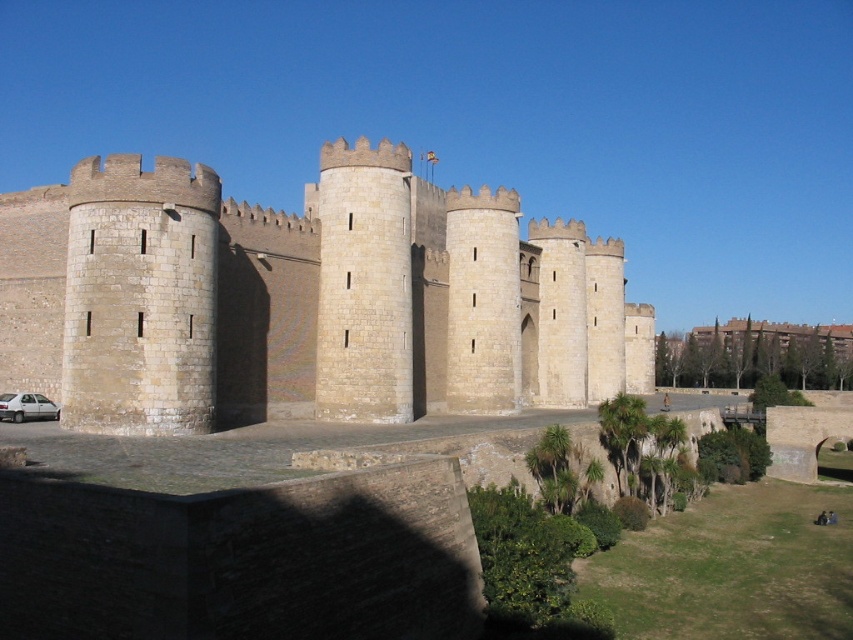
From the picture: You are standing at the entrance of the historic castle and notice two points marked on the ground. One is labeled as point (621, 358) and the other as point (35, 396). If you want to walk towards the castle walls, which point should you avoid stepping on to stay closer to the castle structure?

You should avoid stepping on point (35, 396) because point (621, 358) is closer to the castle walls as it is further to the viewer compared to point (35, 396).

Based on the photo, you are a photographer planning to capture a wide shot of the beige stone castle at center. You notice the silver metallic car at lower left is parked nearby. Considering their sizes, which object will occupy more space in your photo?

The beige stone castle at center will occupy more space in the photo because its width surpasses that of the silver metallic car at lower left.